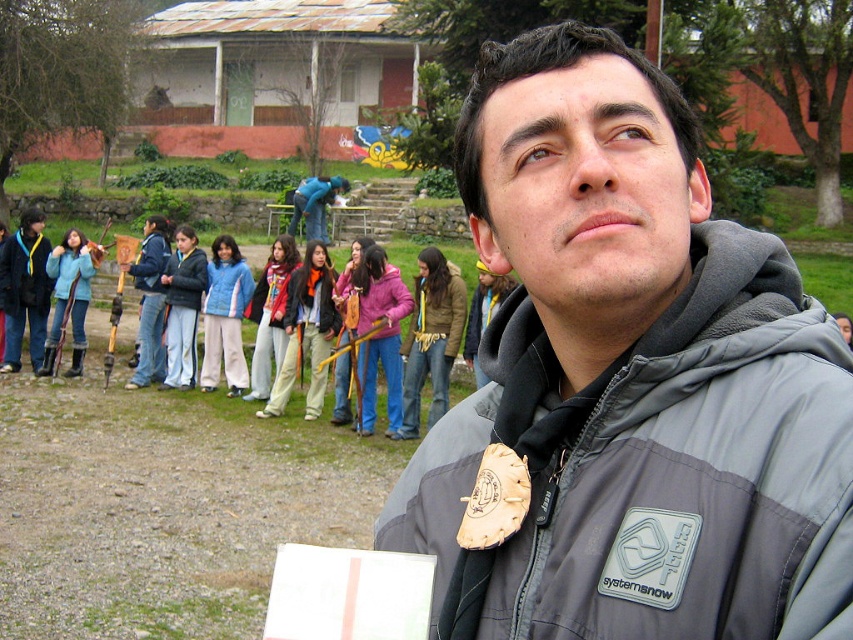
Where is the gray synthetic jacket at center located in the image?

The gray synthetic jacket at center is located at point (654,470) in the image.

You are an observer looking at the scene. You notice two jackets in the image. The gray synthetic jacket at center and the blue fleece jacket at left. Which jacket is positioned lower in the image?

The gray synthetic jacket at center is positioned lower than the blue fleece jacket at left.

You are standing at the location of the gray synthetic jacket at center. You want to hand a tool to the person wearing the blue fleece jacket at left. Can you reach them without moving from your current position?

The gray synthetic jacket at center is 12.67 meters away from the blue fleece jacket at left. Since the distance is too far to reach without moving, you cannot hand the tool directly from your current position.